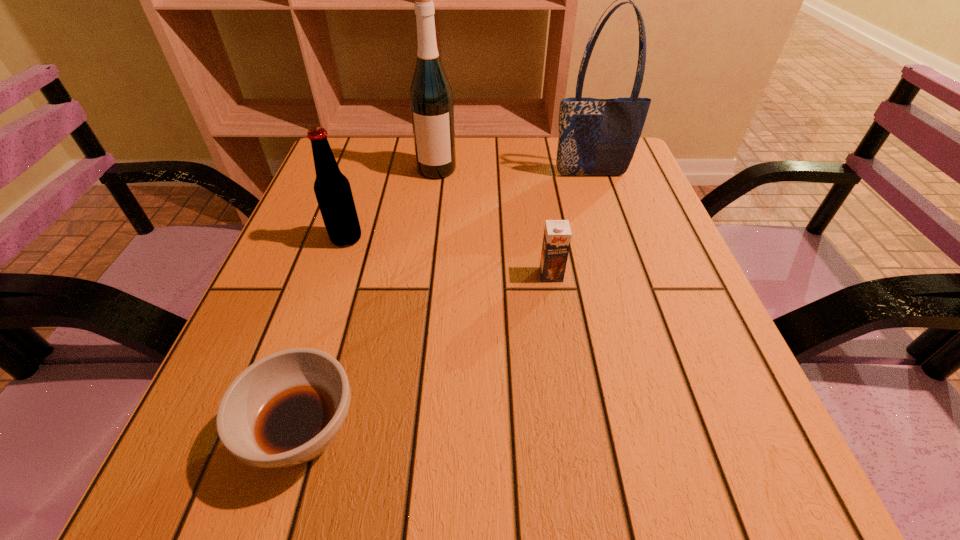
Identify the location of vacant space located on the right of the beer bottle. 387,239.

What are the coordinates of `free space located on the front label of the second shortest object` in the screenshot? It's located at (587, 492).

Locate an element on the screen. The width and height of the screenshot is (960, 540). vacant area located on the right of the soup bowl is located at coordinates (419, 434).

Where is `shopping bag that is positioned at the far edge`? shopping bag that is positioned at the far edge is located at coordinates (597, 137).

Locate an element on the screen. wine bottle present at the far edge is located at coordinates (431, 100).

You are a GUI agent. You are given a task and a screenshot of the screen. Output one action in this format:
    pyautogui.click(x=<x>, y=<y>)
    Task: Click on the object that is at the near edge
    This screenshot has width=960, height=540.
    Given the screenshot: What is the action you would take?
    pyautogui.click(x=285, y=409)

Image resolution: width=960 pixels, height=540 pixels. Identify the location of beer bottle at the left edge. (332, 189).

I want to click on soup bowl at the left edge, so click(285, 409).

You are a GUI agent. You are given a task and a screenshot of the screen. Output one action in this format:
    pyautogui.click(x=<x>, y=<y>)
    Task: Click on the object located at the right edge
    The width and height of the screenshot is (960, 540).
    Given the screenshot: What is the action you would take?
    pyautogui.click(x=597, y=137)

The height and width of the screenshot is (540, 960). Find the location of `object that is positioned at the near left corner`. object that is positioned at the near left corner is located at coordinates (285, 409).